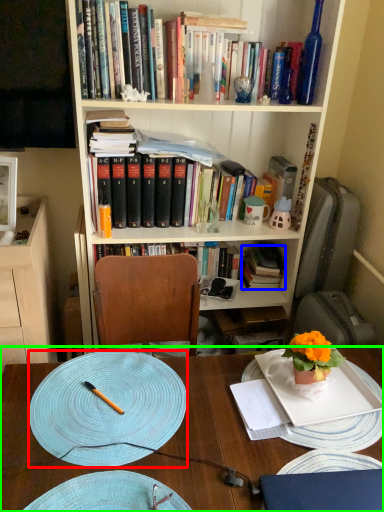
Question: Which is nearer to the plate (highlighted by a red box)? book (highlighted by a blue box) or desk (highlighted by a green box).

Choices:
 (A) book
 (B) desk

Answer: (B)